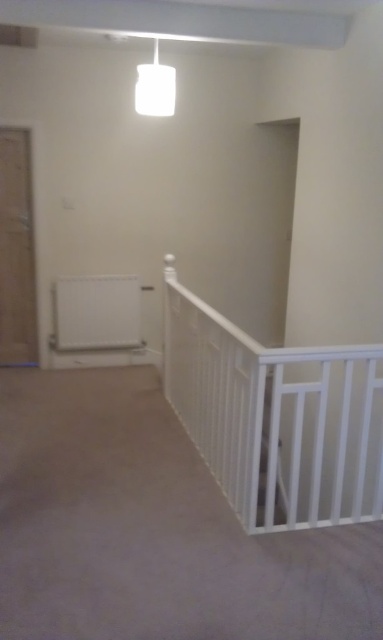
You are standing in the hallway and want to open the wooden door at left. To reach it, you need to walk around the white wooden rail at center. Which direction should you go around the rail to face the door?

Since the white wooden rail at center is closer to the viewer than the wooden door at left, you should walk around the rail to your left side to face the wooden door at left.